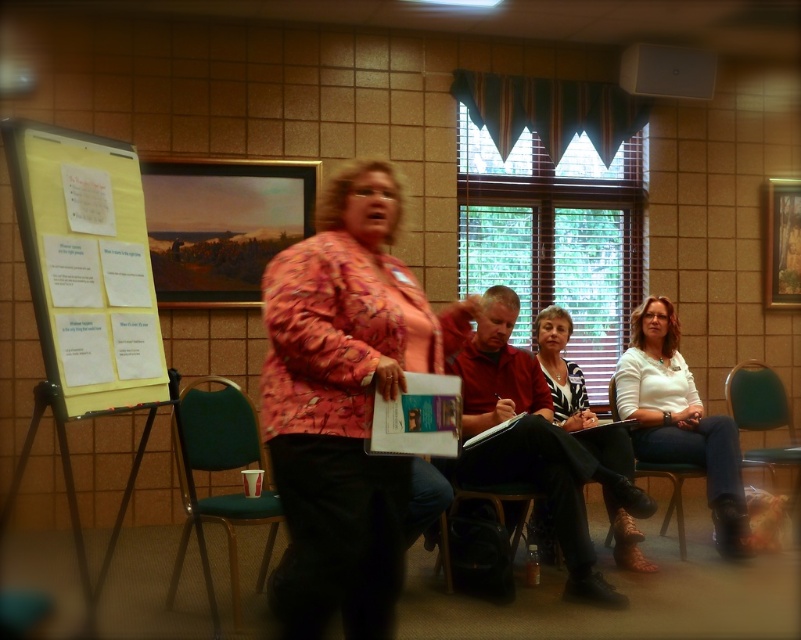
Locate an element on the screen. This screenshot has width=801, height=640. matte red shirt at center is located at coordinates (533, 442).

Is matte red shirt at center to the right of green fabric chair at lower left from the viewer's perspective?

Yes, matte red shirt at center is to the right of green fabric chair at lower left.

I want to click on matte red shirt at center, so click(533, 442).

Can you confirm if floral-patterned fabric at center is shorter than green fabric chair at lower right?

No.

Does floral-patterned fabric at center have a greater height compared to green fabric chair at lower right?

Indeed, floral-patterned fabric at center has a greater height compared to green fabric chair at lower right.

The height and width of the screenshot is (640, 801). I want to click on floral-patterned fabric at center, so click(344, 403).

Is floral-patterned fabric at center to the right of white printed shirt at center from the viewer's perspective?

No, floral-patterned fabric at center is not to the right of white printed shirt at center.

Between floral-patterned fabric at center and white printed shirt at center, which one appears on the right side from the viewer's perspective?

From the viewer's perspective, white printed shirt at center appears more on the right side.

The image size is (801, 640). Describe the element at coordinates (344, 403) in the screenshot. I see `floral-patterned fabric at center` at that location.

Where is `floral-patterned fabric at center`? floral-patterned fabric at center is located at coordinates (344, 403).